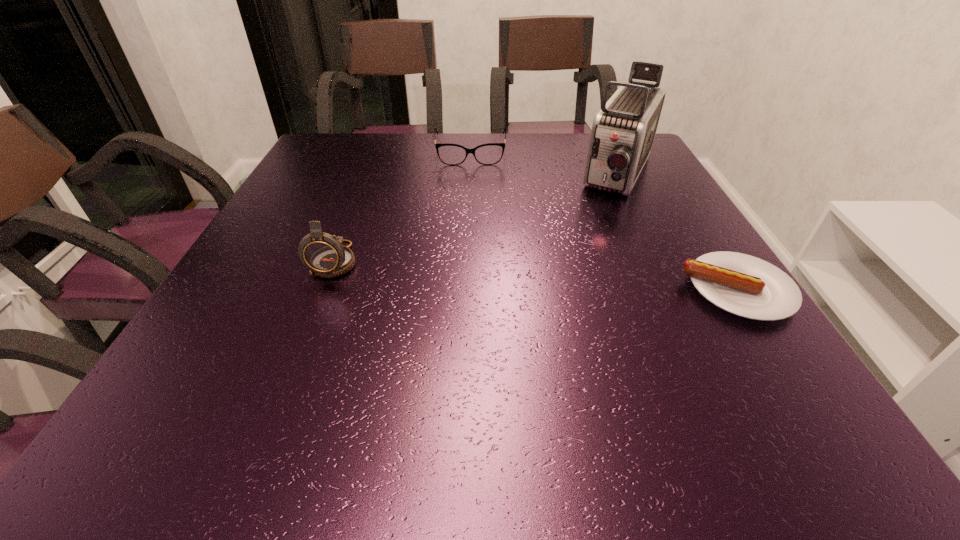
Locate an element on the screen. The height and width of the screenshot is (540, 960). free space at the far edge is located at coordinates (584, 138).

Where is `vacant area at the near edge`? The image size is (960, 540). vacant area at the near edge is located at coordinates (283, 367).

In order to click on vacant space at the left edge of the desktop in this screenshot , I will do `click(330, 187)`.

In order to click on vacant space at the right edge in this screenshot , I will do `click(677, 294)`.

Locate an element on the screen. This screenshot has height=540, width=960. blank area at the far left corner is located at coordinates (344, 149).

The width and height of the screenshot is (960, 540). I want to click on free space that is in between the sausage and the leftmost object, so click(x=537, y=275).

This screenshot has width=960, height=540. Identify the location of vacant point located between the third object from right to left and the shortest object. (604, 221).

Where is `free space between the camcorder and the sausage`? Image resolution: width=960 pixels, height=540 pixels. free space between the camcorder and the sausage is located at coordinates click(x=679, y=232).

Image resolution: width=960 pixels, height=540 pixels. In order to click on free space between the camcorder and the leftmost object in this screenshot , I will do `click(478, 218)`.

At what (x,y) coordinates should I click in order to perform the action: click on vacant area between the sausage and the second tallest object. Please return your answer as a coordinate pair (x, y). Looking at the image, I should click on (537, 275).